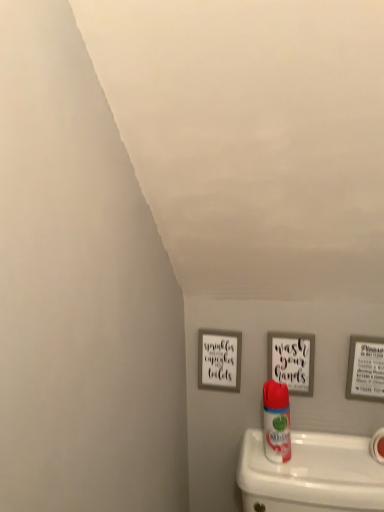
Question: In the image, is white matte toilet paper at lower right positioned in front of or behind matte gray picture frame at right, which is counted as the 1th picture frame, starting from the right?

Choices:
 (A) front
 (B) behind

Answer: (A)

Question: Which is correct: white matte toilet paper at lower right is inside matte gray picture frame at right, which ranks as the 3th picture frame in left-to-right order, or outside of it?

Choices:
 (A) outside
 (B) inside

Answer: (A)

Question: Which is farther from the white matte toilet paper at lower right?

Choices:
 (A) white glossy air freshener at center
 (B) wooden sign at center, acting as the second picture frame starting from the right
 (C) matte gray picture frame at center, the first picture frame from the left
 (D) matte gray picture frame at right, which ranks as the 3th picture frame in left-to-right order

Answer: (C)

Question: Based on their relative distances, which object is nearer to the white glossy air freshener at center?

Choices:
 (A) white matte toilet paper at lower right
 (B) matte gray picture frame at right, which is counted as the 1th picture frame, starting from the right
 (C) matte gray picture frame at center, which ranks as the third picture frame in right-to-left order
 (D) wooden sign at center, acting as the second picture frame starting from the right

Answer: (D)